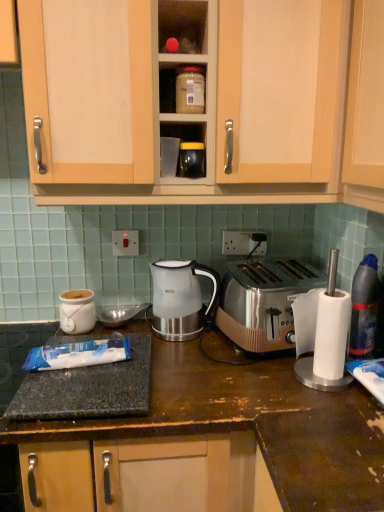
Question: Is granite dark brown at lower left closer to the viewer compared to matte plastic container at upper center?

Choices:
 (A) yes
 (B) no

Answer: (A)

Question: From a real-world perspective, is granite dark brown at lower left over matte plastic container at upper center?

Choices:
 (A) no
 (B) yes

Answer: (A)

Question: Can you confirm if granite dark brown at lower left is wider than matte plastic container at upper center?

Choices:
 (A) yes
 (B) no

Answer: (A)

Question: From a real-world perspective, is granite dark brown at lower left under matte plastic container at upper center?

Choices:
 (A) no
 (B) yes

Answer: (B)

Question: Considering the relative sizes of granite dark brown at lower left and matte plastic container at upper center in the image provided, is granite dark brown at lower left bigger than matte plastic container at upper center?

Choices:
 (A) no
 (B) yes

Answer: (B)

Question: From the image's perspective, is blue glossy bottle at right positioned above or below satin silver toaster at right?

Choices:
 (A) below
 (B) above

Answer: (B)

Question: Do you think blue glossy bottle at right is within satin silver toaster at right, or outside of it?

Choices:
 (A) inside
 (B) outside

Answer: (B)

Question: Considering the relative positions of blue glossy bottle at right and satin silver toaster at right in the image provided, is blue glossy bottle at right to the left or to the right of satin silver toaster at right?

Choices:
 (A) right
 (B) left

Answer: (A)

Question: From a real-world perspective, relative to satin silver toaster at right, is blue glossy bottle at right vertically above or below?

Choices:
 (A) above
 (B) below

Answer: (B)

Question: From the image's perspective, is granite dark brown at lower left located above or below matte black jar at center, which ranks as the second appliance in back-to-front order?

Choices:
 (A) above
 (B) below

Answer: (B)

Question: Does point (220, 424) appear closer or farther from the camera than point (195, 146)?

Choices:
 (A) farther
 (B) closer

Answer: (B)

Question: In the image, is granite dark brown at lower left positioned in front of or behind matte black jar at center, which appears as the first appliance when viewed from the top?

Choices:
 (A) front
 (B) behind

Answer: (A)

Question: In terms of size, does granite dark brown at lower left appear bigger or smaller than matte black jar at center, which appears as the first appliance when viewed from the top?

Choices:
 (A) big
 (B) small

Answer: (A)

Question: Looking at their shapes, would you say matte white ceramic jar at left, arranged as the 1th appliance when viewed from the left, is wider or thinner than satin silver kettle at center?

Choices:
 (A) wide
 (B) thin

Answer: (B)

Question: From the image's perspective, relative to satin silver kettle at center, is matte white ceramic jar at left, arranged as the 1th appliance when viewed from the left, above or below?

Choices:
 (A) below
 (B) above

Answer: (A)